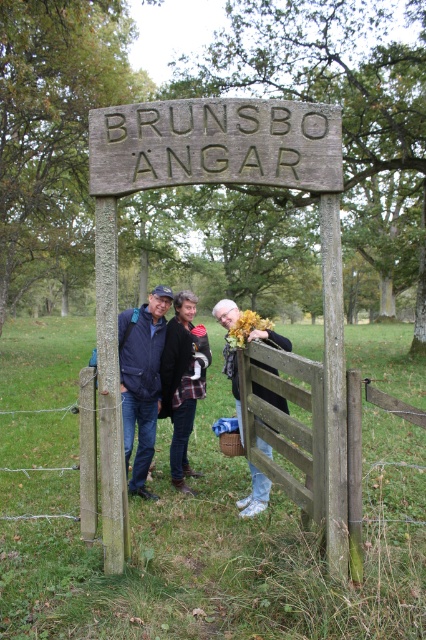
Is wooden gate at center thinner than leather jacket at center?

In fact, wooden gate at center might be wider than leather jacket at center.

Image resolution: width=426 pixels, height=640 pixels. What are the coordinates of `wooden gate at center` in the screenshot? It's located at (287, 422).

Does point (319, 435) come in front of point (267, 490)?

Yes, point (319, 435) is in front of point (267, 490).

Where is `wooden gate at center`? Image resolution: width=426 pixels, height=640 pixels. wooden gate at center is located at coordinates (287, 422).

Can you confirm if weathered wood sign at center is shorter than wooden gate at center?

Indeed, weathered wood sign at center has a lesser height compared to wooden gate at center.

Who is more distant from viewer, [290,166] or [0,467]?

Positioned behind is point [0,467].

Find the location of a particular element. Image resolution: width=426 pixels, height=640 pixels. weathered wood sign at center is located at coordinates (215, 145).

Does weathered wood sign at center have a lesser width compared to flannel shirt at center?

No, weathered wood sign at center is not thinner than flannel shirt at center.

Which of these two, weathered wood sign at center or flannel shirt at center, stands shorter?

With less height is flannel shirt at center.

The height and width of the screenshot is (640, 426). What do you see at coordinates (215, 145) in the screenshot?
I see `weathered wood sign at center` at bounding box center [215, 145].

At what (x,y) coordinates should I click in order to perform the action: click on weathered wood sign at center. Please return your answer as a coordinate pair (x, y). The image size is (426, 640). Looking at the image, I should click on (215, 145).